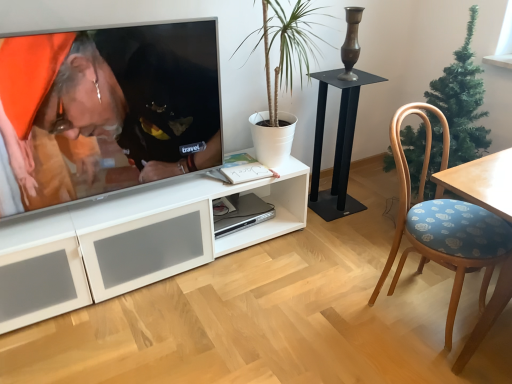
This screenshot has width=512, height=384. I want to click on free space behind green artificial christmas tree at right, so click(x=376, y=190).